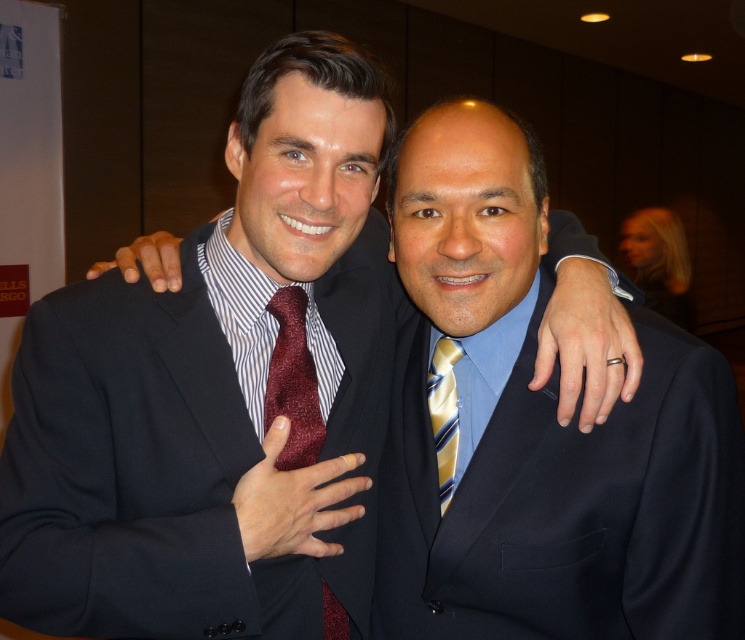
You are a photographer trying to position a spotlight for a portrait. The scene has two men in suits. The first man is wearing a dark suit with a striped light blue shirt and maroon tie, and the second man has a dark suit with a light blue shirt and gold diagonal stripe tie. You need to place the spotlight at the exact center between their suits. Given that the coordinate point at (567, 499) marks the matte black suit at center, can you confirm if this point is suitable for the spotlight?

The point at (567, 499) marks the matte black suit at center, so this coordinate is suitable for placing the spotlight as it directly targets the center between their suits.

You are a photographer setting up for a group photo. You need to ensure that all subjects are clearly visible. Given the matte black suit at center and the maroon textured tie at center, which one should you focus on first to ensure proper focus?

The matte black suit at center is bigger than the maroon textured tie at center, so you should focus on the matte black suit at center first since it is larger and more prominent in the frame.

You are a photographer adjusting the camera settings for a portrait of two men. You notice the matte black suit at center and the yellow striped tie at center in the frame. Which object should you focus on first if you want to ensure the taller one is in sharp focus?

The matte black suit at center is taller than the yellow striped tie at center, so you should focus on the matte black suit at center first to ensure it is in sharp focus.